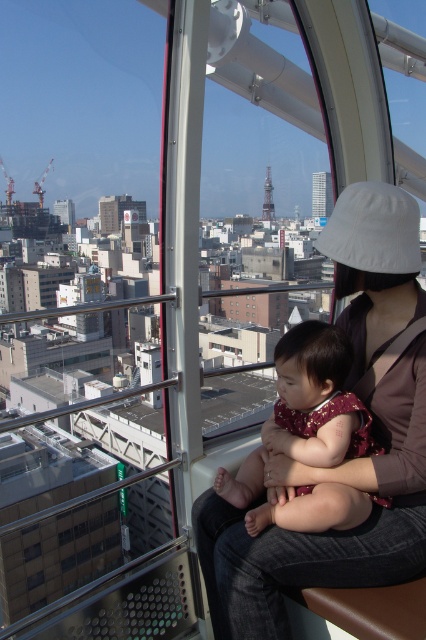
Measure the distance between white fabric hat at upper right and camera.

white fabric hat at upper right and camera are 152.56 feet apart from each other.

Can you confirm if white fabric hat at upper right is thinner than transparent glass window at center?

Incorrect, white fabric hat at upper right's width is not less than transparent glass window at center's.

Does point (322, 252) come in front of point (37, 541)?

That is True.

Identify the location of white fabric hat at upper right. The width and height of the screenshot is (426, 640). (328, 531).

Is white fabric hat at upper right taller than maroon fabric baby at center?

Yes, white fabric hat at upper right is taller than maroon fabric baby at center.

Which is in front, point (388, 454) or point (339, 435)?

Positioned in front is point (339, 435).

The image size is (426, 640). Describe the element at coordinates (328, 531) in the screenshot. I see `white fabric hat at upper right` at that location.

Locate an element on the screen. white fabric hat at upper right is located at coordinates (328, 531).

Can you confirm if maroon fabric baby at center is thinner than transparent glass window at center?

Incorrect, maroon fabric baby at center's width is not less than transparent glass window at center's.

Who is shorter, maroon fabric baby at center or transparent glass window at center?

With less height is transparent glass window at center.

Between point (313, 449) and point (37, 548), which one is positioned in front?

Positioned in front is point (313, 449).

Where is `maroon fabric baby at center`? This screenshot has width=426, height=640. maroon fabric baby at center is located at coordinates (305, 410).